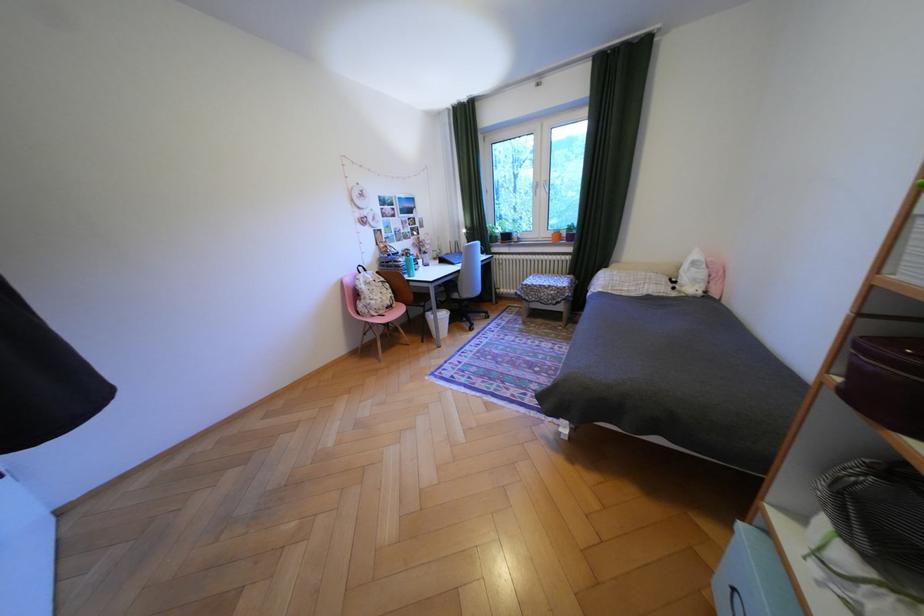
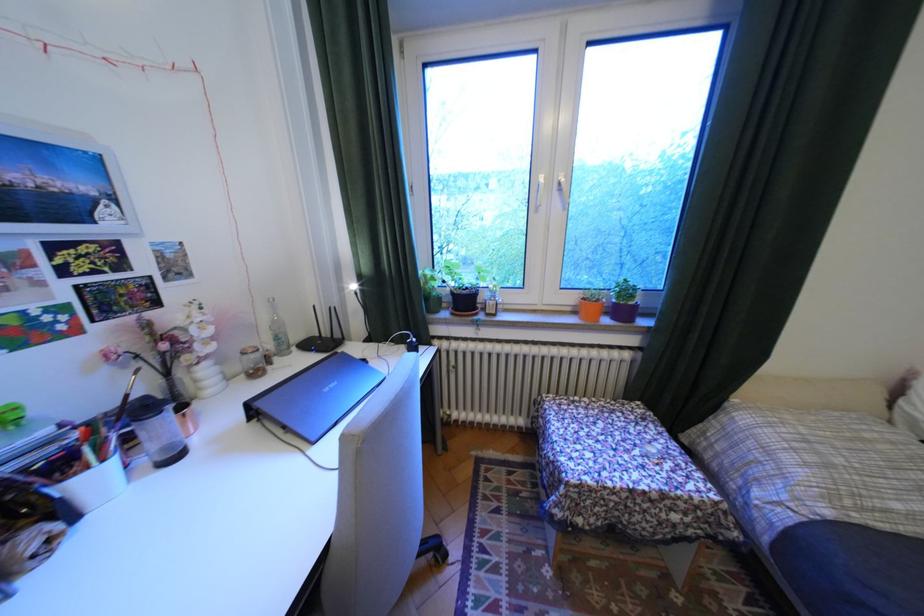
Locate, in the second image, the point that corresponds to pixel 432 262 in the first image.

(106, 479)